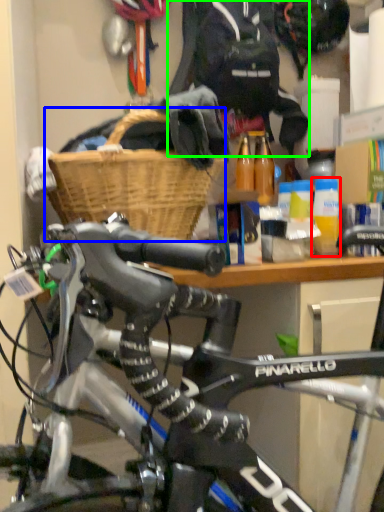
Question: Which is nearer to the bottle (highlighted by a red box)? basket (highlighted by a blue box) or clothing (highlighted by a green box).

Choices:
 (A) basket
 (B) clothing

Answer: (A)